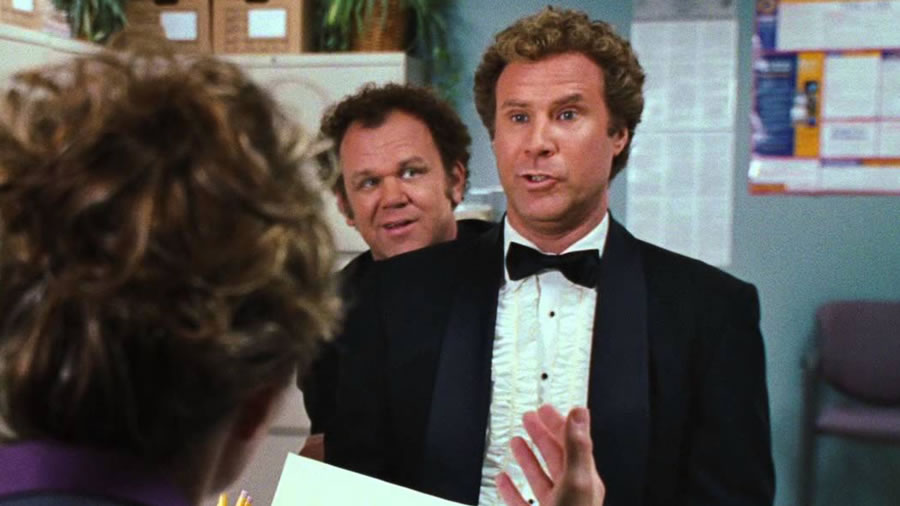
I want to click on wall, so [778, 226].